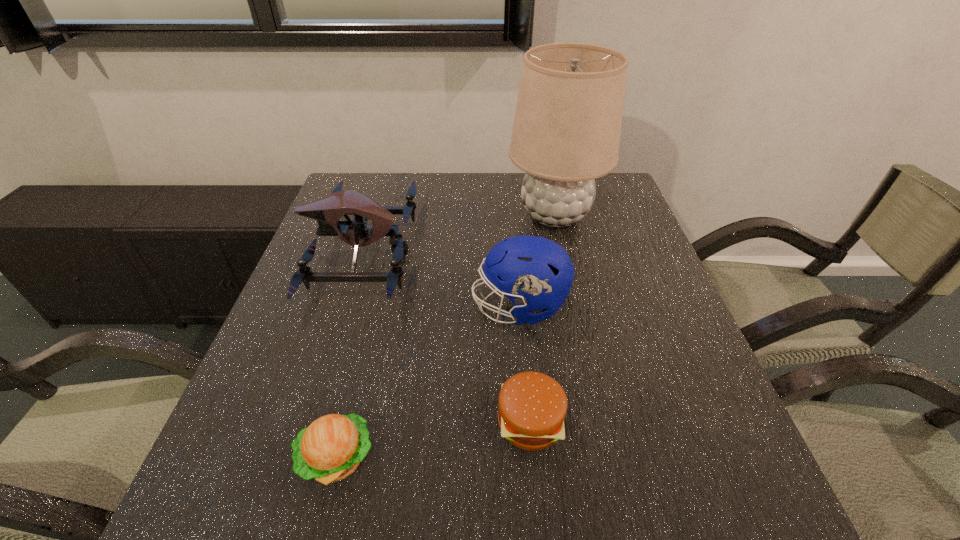
You are a GUI agent. You are given a task and a screenshot of the screen. Output one action in this format:
    pyautogui.click(x=<x>, y=<y>)
    Task: Click on the free space located on the left of the left hamburger
    
    Given the screenshot: What is the action you would take?
    pyautogui.click(x=228, y=458)

Locate an element on the screen. The width and height of the screenshot is (960, 540). vacant region located on the front of the right hamburger is located at coordinates (539, 515).

The width and height of the screenshot is (960, 540). I want to click on lampshade situated at the far edge, so click(566, 133).

This screenshot has height=540, width=960. I want to click on drone that is at the far edge, so click(327, 210).

Identify the location of object present at the near edge. This screenshot has width=960, height=540. (330, 449).

Find the location of a particular element. drone at the left edge is located at coordinates (327, 210).

Find the location of a particular element. The height and width of the screenshot is (540, 960). hamburger that is positioned at the left edge is located at coordinates (330, 449).

Identify the location of object at the right edge. (566, 133).

The height and width of the screenshot is (540, 960). I want to click on object that is at the far left corner, so click(327, 210).

The image size is (960, 540). In order to click on object that is at the near left corner in this screenshot , I will do `click(330, 449)`.